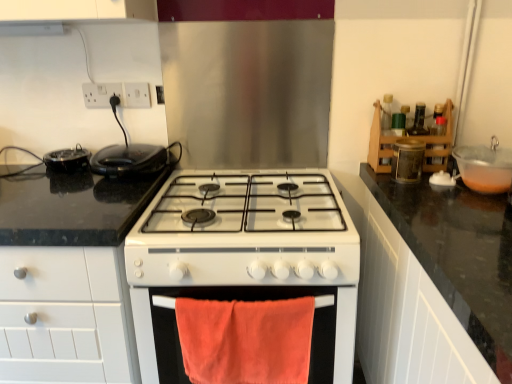
You are a GUI agent. You are given a task and a screenshot of the screen. Output one action in this format:
    pyautogui.click(x=<x>, y=<y>)
    Task: Click on the vacant space underneath black glossy waffle maker at left, which is the 1th kitchen appliance in right-to-left order (from a real-world perspective)
    
    Given the screenshot: What is the action you would take?
    pyautogui.click(x=128, y=178)